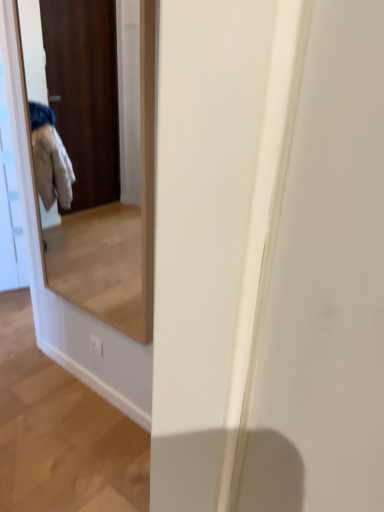
What are the coordinates of `blank area beneath matte wooden mirror at upper left (from a real-world perspective)` in the screenshot? It's located at (92, 382).